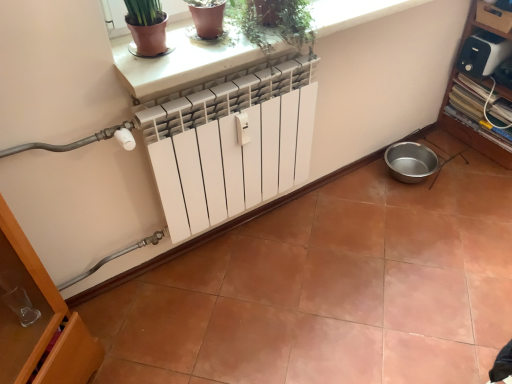
Question: From a real-world perspective, is green matte plant at upper center located higher than white glossy radiator at center?

Choices:
 (A) yes
 (B) no

Answer: (A)

Question: Is green matte plant at upper center surrounding white glossy radiator at center?

Choices:
 (A) no
 (B) yes

Answer: (A)

Question: Can you confirm if green matte plant at upper center is positioned to the left of white glossy radiator at center?

Choices:
 (A) no
 (B) yes

Answer: (B)

Question: Is green matte plant at upper center not inside white glossy radiator at center?

Choices:
 (A) no
 (B) yes

Answer: (B)

Question: Does green matte plant at upper center have a greater width compared to white glossy radiator at center?

Choices:
 (A) yes
 (B) no

Answer: (B)

Question: Looking at their shapes, would you say white smooth ledge at upper center is wider or thinner than green matte plant at upper center?

Choices:
 (A) thin
 (B) wide

Answer: (B)

Question: From the image's perspective, is white smooth ledge at upper center located above or below green matte plant at upper center?

Choices:
 (A) above
 (B) below

Answer: (A)

Question: Considering the positions of white smooth ledge at upper center and green matte plant at upper center in the image, is white smooth ledge at upper center taller or shorter than green matte plant at upper center?

Choices:
 (A) tall
 (B) short

Answer: (B)

Question: Based on their sizes in the image, would you say white smooth ledge at upper center is bigger or smaller than green matte plant at upper center?

Choices:
 (A) small
 (B) big

Answer: (A)

Question: Looking at their shapes, would you say white glossy radiator at center is wider or thinner than white smooth ledge at upper center?

Choices:
 (A) wide
 (B) thin

Answer: (A)

Question: In the image, is white glossy radiator at center positioned in front of or behind white smooth ledge at upper center?

Choices:
 (A) behind
 (B) front

Answer: (B)

Question: Is white glossy radiator at center to the left or to the right of white smooth ledge at upper center in the image?

Choices:
 (A) right
 (B) left

Answer: (A)

Question: In terms of height, does white glossy radiator at center look taller or shorter compared to white smooth ledge at upper center?

Choices:
 (A) short
 (B) tall

Answer: (A)

Question: Visually, is green matte plant at upper center positioned to the left or to the right of white smooth ledge at upper center?

Choices:
 (A) right
 (B) left

Answer: (B)

Question: From a real-world perspective, is green matte plant at upper center physically located above or below white smooth ledge at upper center?

Choices:
 (A) above
 (B) below

Answer: (A)